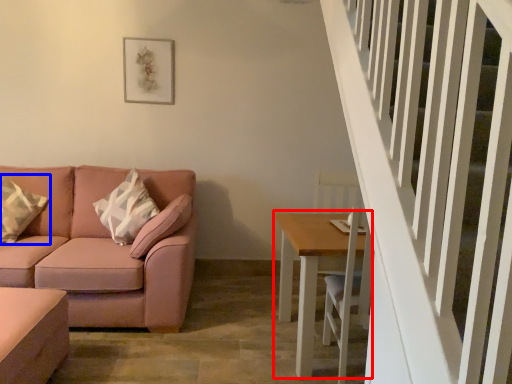
Question: Which object appears farthest to the camera in this image, table (highlighted by a red box) or pillow (highlighted by a blue box)?

Choices:
 (A) table
 (B) pillow

Answer: (B)